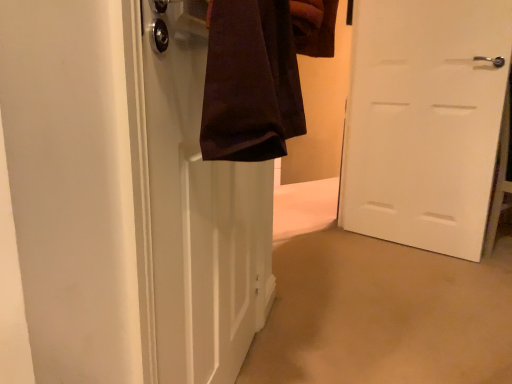
Locate an element on the screen. Image resolution: width=512 pixels, height=384 pixels. vacant space situated on the left part of white matte door at center is located at coordinates (346, 252).